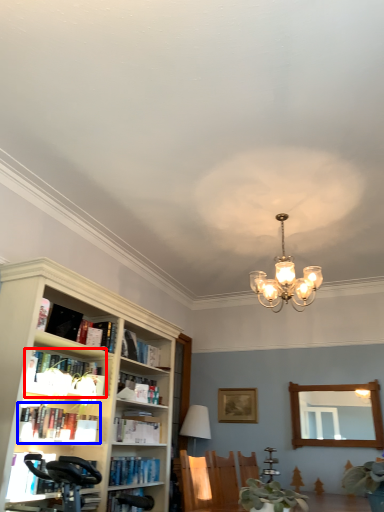
Question: Which point is closer to the camera, book (highlighted by a red box) or book (highlighted by a blue box)?

Choices:
 (A) book
 (B) book

Answer: (B)